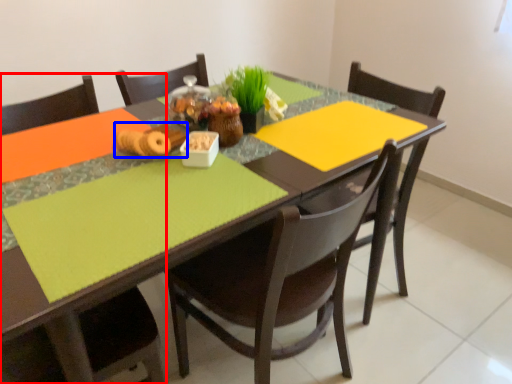
Question: Which object appears farthest to the camera in this image, chair (highlighted by a red box) or food (highlighted by a blue box)?

Choices:
 (A) chair
 (B) food

Answer: (B)